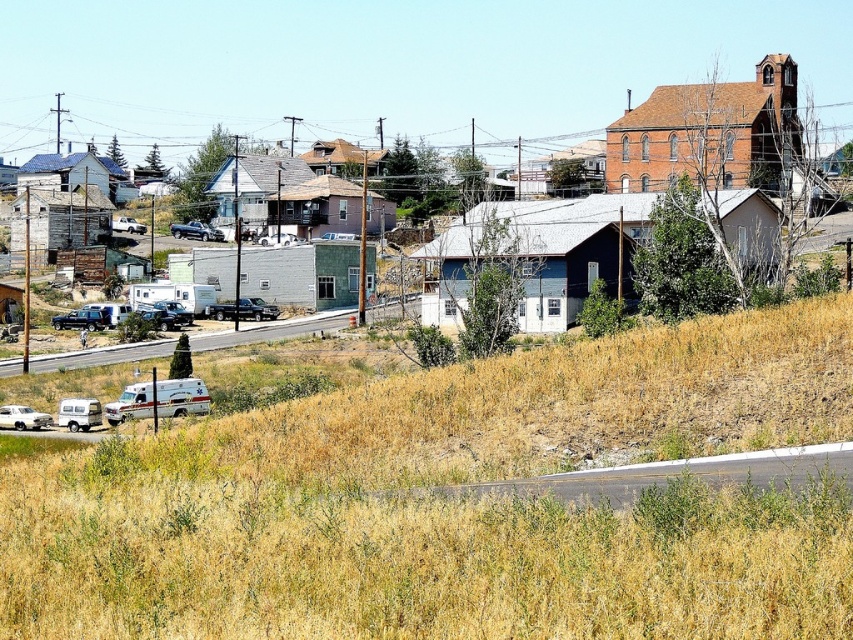
Can you confirm if dry grass at lower center is positioned to the right of matte gray building at center?

Incorrect, dry grass at lower center is not on the right side of matte gray building at center.

Where is `dry grass at lower center`? The height and width of the screenshot is (640, 853). dry grass at lower center is located at coordinates (459, 502).